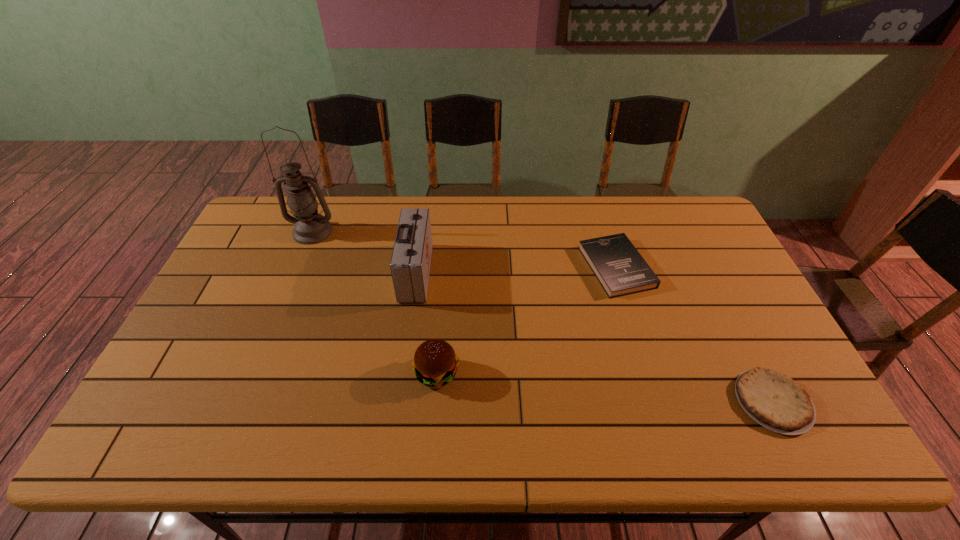
Where is `the leftmost object`? This screenshot has height=540, width=960. the leftmost object is located at coordinates (310, 227).

Identify the location of oil lamp. The width and height of the screenshot is (960, 540). (310, 227).

I want to click on the first-aid kit, so click(410, 263).

This screenshot has width=960, height=540. In order to click on the third tallest object in this screenshot , I will do `click(435, 362)`.

You are a GUI agent. You are given a task and a screenshot of the screen. Output one action in this format:
    pyautogui.click(x=<x>, y=<y>)
    Task: Click on the second object from right to left
    The width and height of the screenshot is (960, 540).
    Given the screenshot: What is the action you would take?
    pyautogui.click(x=621, y=270)

At what (x,y) coordinates should I click in order to perform the action: click on the fourth tallest object. Please return your answer as a coordinate pair (x, y). This screenshot has height=540, width=960. Looking at the image, I should click on (621, 270).

The width and height of the screenshot is (960, 540). I want to click on the rightmost object, so [774, 400].

Find the location of a particular element. The image size is (960, 540). tortilla is located at coordinates (774, 400).

This screenshot has height=540, width=960. Find the location of `vacant space located on the front of the tallest object`. vacant space located on the front of the tallest object is located at coordinates (275, 326).

Where is `free spot located on the front-facing side of the fourth shortest object`? free spot located on the front-facing side of the fourth shortest object is located at coordinates click(481, 273).